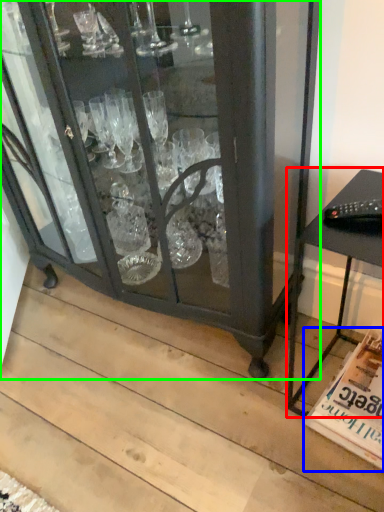
Question: Based on their relative distances, which object is nearer to table (highlighted by a red box)? Choose from magazine (highlighted by a blue box) and furniture (highlighted by a green box).

Choices:
 (A) magazine
 (B) furniture

Answer: (A)